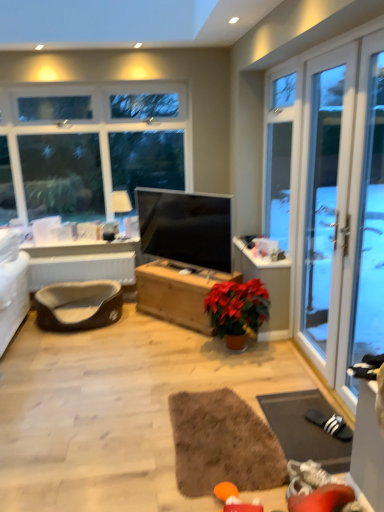
Identify the location of blank area to the left of wooden chest at center. (128, 330).